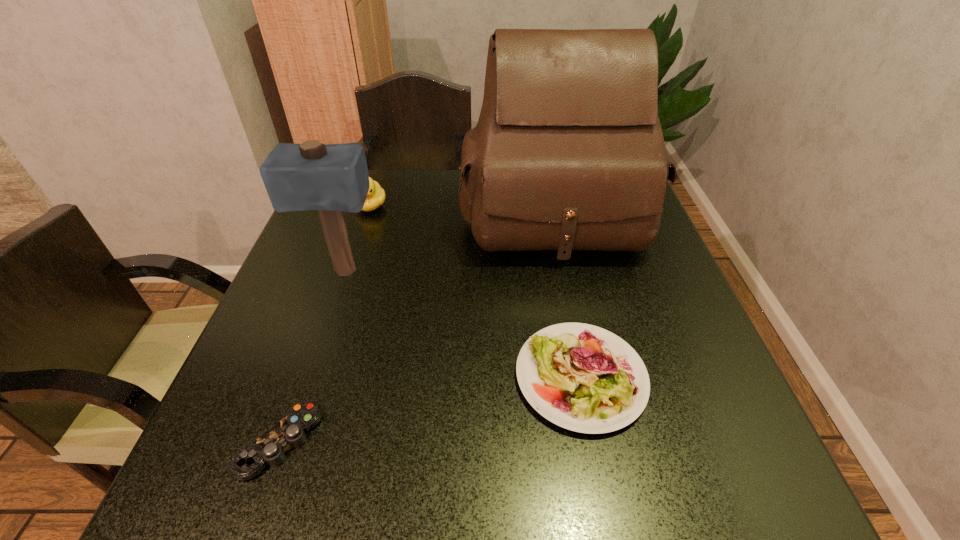
The width and height of the screenshot is (960, 540). I want to click on satchel that is at the far edge, so click(x=568, y=153).

Identify the location of duckling at the far edge. The image size is (960, 540). (375, 198).

At what (x,y) coordinates should I click in order to perform the action: click on object located in the near edge section of the desktop. Please return your answer as a coordinate pair (x, y). Looking at the image, I should click on (270, 448).

At what (x,y) coordinates should I click in order to perform the action: click on mallet that is at the left edge. Please return your answer as a coordinate pair (x, y). Looking at the image, I should click on (331, 178).

I want to click on duckling that is at the left edge, so click(375, 198).

Identify the location of control located in the left edge section of the desktop. (270, 448).

Identify the location of satchel that is at the right edge. This screenshot has height=540, width=960. (568, 153).

Locate an element on the screen. This screenshot has height=540, width=960. salad plate that is positioned at the right edge is located at coordinates (581, 377).

What are the coordinates of `object at the far left corner` in the screenshot? It's located at (375, 198).

Identify the location of object present at the near left corner. The height and width of the screenshot is (540, 960). (270, 448).